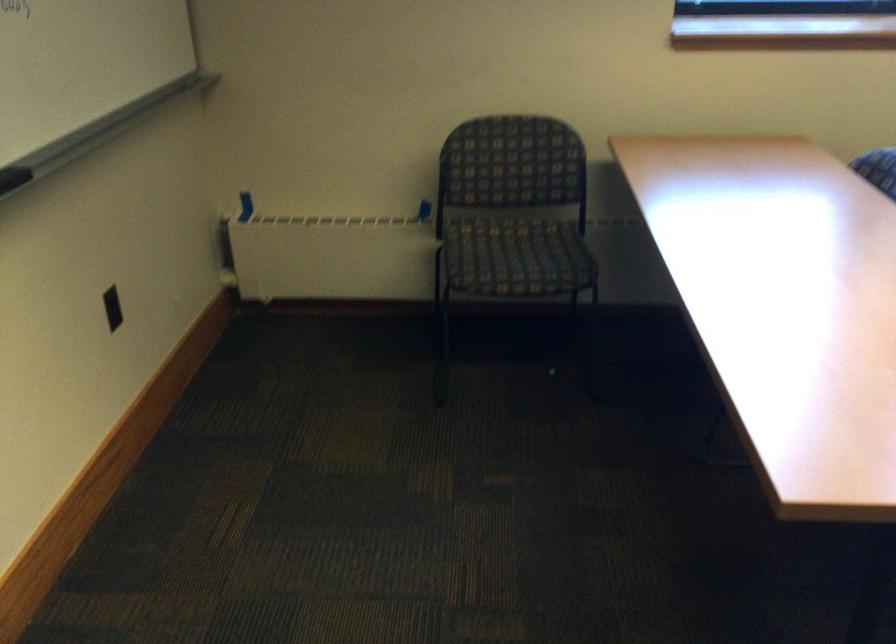
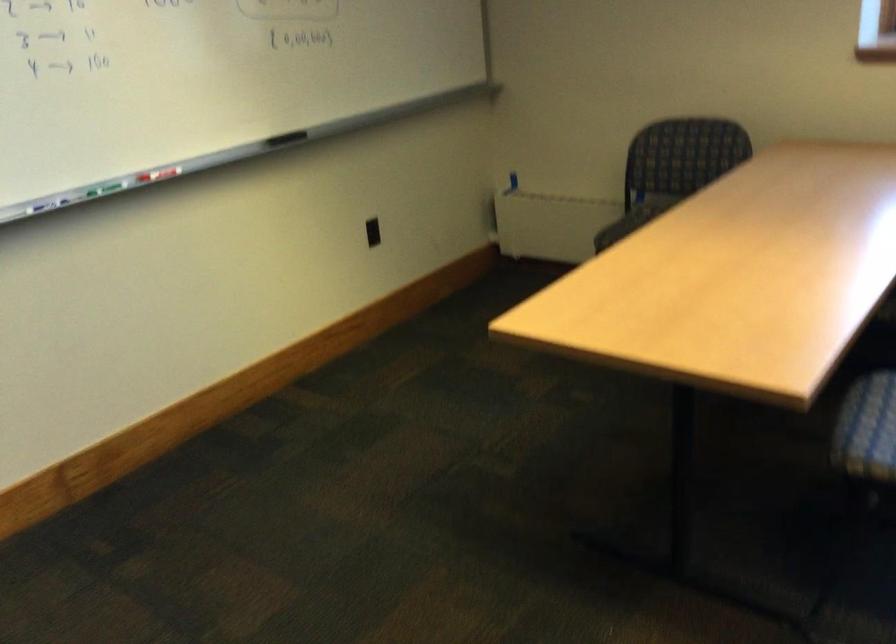
The point at (269, 205) is marked in the first image. Where is the corresponding point in the second image?

(513, 180)